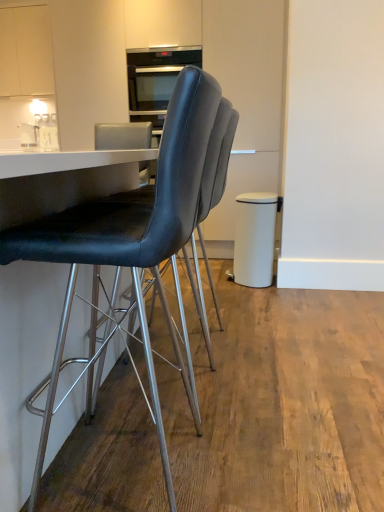
What is the approximate height of matte black oven at upper center, the 1th appliance positioned from the right?

18.48 inches.

What do you see at coordinates (29, 135) in the screenshot? I see `white glossy salt shaker at upper left, which is the 2th appliance from right to left` at bounding box center [29, 135].

The image size is (384, 512). In order to click on white glossy salt shaker at upper left, the 2th appliance from the front in this screenshot , I will do `click(29, 135)`.

What do you see at coordinates (25, 51) in the screenshot? The height and width of the screenshot is (512, 384). I see `white matte cabinet at upper left` at bounding box center [25, 51].

Describe the element at coordinates (254, 239) in the screenshot. I see `white matte trash can at right` at that location.

Find the location of a particular element. The image size is (384, 512). matte black oven at upper center, the 1th appliance positioned from the right is located at coordinates (156, 76).

Is white glossy salt shaker at upper left, acting as the first appliance starting from the left, to the right of matte black oven at upper center, the 1th appliance positioned from the right, from the viewer's perspective?

No, white glossy salt shaker at upper left, acting as the first appliance starting from the left, is not to the right of matte black oven at upper center, the 1th appliance positioned from the right.

Considering the relative sizes of white glossy salt shaker at upper left, marked as the 1th appliance in a back-to-front arrangement, and matte black oven at upper center, positioned as the second appliance in left-to-right order, in the image provided, is white glossy salt shaker at upper left, marked as the 1th appliance in a back-to-front arrangement, smaller than matte black oven at upper center, positioned as the second appliance in left-to-right order,?

Indeed, white glossy salt shaker at upper left, marked as the 1th appliance in a back-to-front arrangement, has a smaller size compared to matte black oven at upper center, positioned as the second appliance in left-to-right order.

Which of these two, white glossy salt shaker at upper left, acting as the first appliance starting from the left, or matte black oven at upper center, arranged as the 2th appliance when viewed from the back, stands taller?

matte black oven at upper center, arranged as the 2th appliance when viewed from the back.

From a real-world perspective, who is located lower, black leather chair at center, placed as the second chair when sorted from back to front, or white matte trash can at right?

white matte trash can at right is physically lower.

From the image's perspective, starting from the white matte trash can at right, which chair is the 2nd one below? Please provide its 2D coordinates.

[(133, 242)]

Is black leather chair at center, placed as the second chair when sorted from back to front, wider than white matte trash can at right?

Correct, the width of black leather chair at center, placed as the second chair when sorted from back to front, exceeds that of white matte trash can at right.

Between black leather chair at center, arranged as the 1th chair when viewed from the front, and white matte trash can at right, which one is positioned behind?

Positioned behind is white matte trash can at right.

Does white glossy salt shaker at upper left, marked as the 1th appliance in a back-to-front arrangement, lie behind black leather chair at center, placed as the second chair when sorted from back to front?

Yes.

Is white glossy salt shaker at upper left, which is the 2th appliance from right to left, far away from black leather chair at center, arranged as the 1th chair when viewed from the front?

Yes.

How much distance is there between white glossy salt shaker at upper left, acting as the first appliance starting from the left, and black leather chair at center, placed as the second chair when sorted from back to front?

3.28 meters.

Considering the positions of points (240, 282) and (26, 141), is point (240, 282) closer to camera compared to point (26, 141)?

Yes, it is.

Visually, is white matte trash can at right positioned to the left or to the right of white glossy salt shaker at upper left, acting as the first appliance starting from the left?

From the image, it's evident that white matte trash can at right is to the right of white glossy salt shaker at upper left, acting as the first appliance starting from the left.

Considering the sizes of objects white matte trash can at right and white glossy salt shaker at upper left, marked as the 1th appliance in a back-to-front arrangement, in the image provided, who is thinner, white matte trash can at right or white glossy salt shaker at upper left, marked as the 1th appliance in a back-to-front arrangement,?

white glossy salt shaker at upper left, marked as the 1th appliance in a back-to-front arrangement, is thinner.

Considering the sizes of objects white matte trash can at right and white glossy salt shaker at upper left, the 2th appliance from the front, in the image provided, who is shorter, white matte trash can at right or white glossy salt shaker at upper left, the 2th appliance from the front,?

With less height is white glossy salt shaker at upper left, the 2th appliance from the front.

At what (x,y) coordinates should I click in order to perform the action: click on bar stool in front of the white matte cabinet at upper left. Please return your answer as a coordinate pair (x, y). The width and height of the screenshot is (384, 512). Looking at the image, I should click on (254, 239).

Between white matte trash can at right and white matte cabinet at upper left, which one has larger size?

white matte cabinet at upper left.

From the picture: What's the angular difference between white matte trash can at right and white matte cabinet at upper left's facing directions?

The angular difference between white matte trash can at right and white matte cabinet at upper left is 90 degrees.

Is white matte trash can at right next to white matte cabinet at upper left?

white matte trash can at right is not next to white matte cabinet at upper left, and they're not touching.

Which object is more forward, black leather chair at center, placed as the second chair when sorted from back to front, or white matte cabinet at upper left?

black leather chair at center, placed as the second chair when sorted from back to front, is closer to the camera.

Is black leather chair at center, arranged as the 1th chair when viewed from the front, shorter than white matte cabinet at upper left?

No, black leather chair at center, arranged as the 1th chair when viewed from the front, is not shorter than white matte cabinet at upper left.

In terms of width, does black leather chair at center, placed as the second chair when sorted from back to front, look wider or thinner when compared to white matte cabinet at upper left?

Clearly, black leather chair at center, placed as the second chair when sorted from back to front, has more width compared to white matte cabinet at upper left.

The width and height of the screenshot is (384, 512). Identify the location of cabinetry behind the black leather chair at center, placed as the second chair when sorted from back to front. (25, 51).

Is white glossy salt shaker at upper left, marked as the 1th appliance in a back-to-front arrangement, wider or thinner than black leather chair at center, the 1th chair from the back?

Considering their sizes, white glossy salt shaker at upper left, marked as the 1th appliance in a back-to-front arrangement, looks slimmer than black leather chair at center, the 1th chair from the back.

How distant is white glossy salt shaker at upper left, marked as the 1th appliance in a back-to-front arrangement, from black leather chair at center, the 1th chair from the back?

They are 9.68 feet apart.

Between white glossy salt shaker at upper left, the 2th appliance from the front, and black leather chair at center, placed as the 2th chair when sorted from front to back, which one has more height?

black leather chair at center, placed as the 2th chair when sorted from front to back, is taller.

Could you tell me if white glossy salt shaker at upper left, which is the 2th appliance from right to left, is facing black leather chair at center, the 1th chair from the back?

No, white glossy salt shaker at upper left, which is the 2th appliance from right to left, is not oriented towards black leather chair at center, the 1th chair from the back.

Find the location of a particular element. The height and width of the screenshot is (512, 384). appliance above the white glossy salt shaker at upper left, acting as the first appliance starting from the left (from a real-world perspective) is located at coordinates (156, 76).

Find the location of a particular element. The height and width of the screenshot is (512, 384). bar stool on the right side of black leather chair at center, placed as the second chair when sorted from back to front is located at coordinates (254, 239).

Estimate the real-world distances between objects in this image. Which object is further from matte black oven at upper center, the 1th appliance positioned from the right, white matte trash can at right or white glossy salt shaker at upper left, acting as the first appliance starting from the left?

white glossy salt shaker at upper left, acting as the first appliance starting from the left.

From the image, which object appears to be nearer to white glossy salt shaker at upper left, marked as the 1th appliance in a back-to-front arrangement, white matte cabinet at upper left or black leather chair at center, placed as the second chair when sorted from back to front?

white matte cabinet at upper left is closer to white glossy salt shaker at upper left, marked as the 1th appliance in a back-to-front arrangement.

Which object lies nearer to the anchor point white matte trash can at right, black leather chair at center, placed as the second chair when sorted from back to front, or white glossy salt shaker at upper left, the 2th appliance from the front?

black leather chair at center, placed as the second chair when sorted from back to front.

Considering their positions, is white matte trash can at right positioned closer to white matte cabinet at upper left than black leather chair at center, the 1th chair from the back?

white matte trash can at right.

Estimate the real-world distances between objects in this image. Which object is closer to white glossy salt shaker at upper left, marked as the 1th appliance in a back-to-front arrangement, black leather chair at center, placed as the 2th chair when sorted from front to back, or matte black oven at upper center, arranged as the 2th appliance when viewed from the back?

matte black oven at upper center, arranged as the 2th appliance when viewed from the back.

From the image, which object appears to be farther from black leather chair at center, the 1th chair from the back, matte black oven at upper center, positioned as the second appliance in left-to-right order, or white glossy salt shaker at upper left, which is the 2th appliance from right to left?

A: white glossy salt shaker at upper left, which is the 2th appliance from right to left, is positioned further to the anchor black leather chair at center, the 1th chair from the back.

Estimate the real-world distances between objects in this image. Which object is further from matte black oven at upper center, which is counted as the first appliance, starting from the front, white glossy salt shaker at upper left, acting as the first appliance starting from the left, or black leather chair at center, arranged as the 1th chair when viewed from the front?

black leather chair at center, arranged as the 1th chair when viewed from the front.

Considering their positions, is black leather chair at center, placed as the second chair when sorted from back to front, positioned closer to black leather chair at center, the 1th chair from the back, than matte black oven at upper center, positioned as the second appliance in left-to-right order?

black leather chair at center, placed as the second chair when sorted from back to front, lies closer to black leather chair at center, the 1th chair from the back, than the other object.

This screenshot has width=384, height=512. Identify the location of bar stool between black leather chair at center, placed as the 2th chair when sorted from front to back, and matte black oven at upper center, the 1th appliance positioned from the right, from front to back. (254, 239).

The width and height of the screenshot is (384, 512). Identify the location of chair between black leather chair at center, placed as the second chair when sorted from back to front, and matte black oven at upper center, which is counted as the first appliance, starting from the front, along the z-axis. (215, 175).

The width and height of the screenshot is (384, 512). I want to click on appliance between black leather chair at center, placed as the 2th chair when sorted from front to back, and white matte cabinet at upper left in the front-back direction, so click(x=156, y=76).

Identify the location of cabinetry between black leather chair at center, placed as the 2th chair when sorted from front to back, and white glossy salt shaker at upper left, the 2th appliance from the front, along the z-axis. (25, 51).